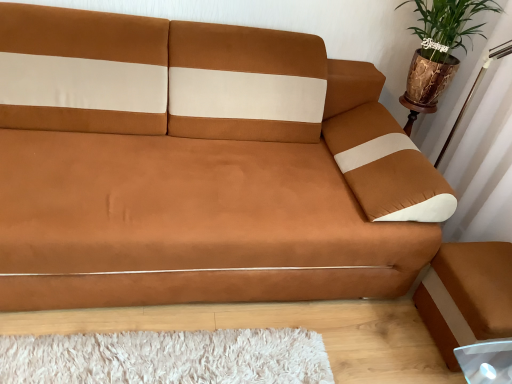
Question: Considering the relative positions of brown leather footrest at lower right and suede brown couch at center in the image provided, is brown leather footrest at lower right behind suede brown couch at center?

Choices:
 (A) yes
 (B) no

Answer: (A)

Question: From a real-world perspective, is brown leather footrest at lower right physically above suede brown couch at center?

Choices:
 (A) yes
 (B) no

Answer: (B)

Question: Considering the relative sizes of brown leather footrest at lower right and suede brown couch at center in the image provided, is brown leather footrest at lower right taller than suede brown couch at center?

Choices:
 (A) yes
 (B) no

Answer: (B)

Question: From the image's perspective, is brown leather footrest at lower right located above suede brown couch at center?

Choices:
 (A) no
 (B) yes

Answer: (A)

Question: Is brown leather footrest at lower right wider than suede brown couch at center?

Choices:
 (A) no
 (B) yes

Answer: (A)

Question: Is brown leather footrest at lower right far away from suede brown couch at center?

Choices:
 (A) no
 (B) yes

Answer: (A)

Question: Considering the relative positions of suede brown couch at center and green leafy plant in brown pot at upper right in the image provided, is suede brown couch at center to the left of green leafy plant in brown pot at upper right from the viewer's perspective?

Choices:
 (A) yes
 (B) no

Answer: (A)

Question: Considering the relative sizes of suede brown couch at center and green leafy plant in brown pot at upper right in the image provided, is suede brown couch at center thinner than green leafy plant in brown pot at upper right?

Choices:
 (A) yes
 (B) no

Answer: (B)

Question: From a real-world perspective, is suede brown couch at center located higher than green leafy plant in brown pot at upper right?

Choices:
 (A) no
 (B) yes

Answer: (A)

Question: Is suede brown couch at center not near green leafy plant in brown pot at upper right?

Choices:
 (A) no
 (B) yes

Answer: (A)

Question: From the image's perspective, is suede brown couch at center on green leafy plant in brown pot at upper right?

Choices:
 (A) yes
 (B) no

Answer: (B)

Question: Can you confirm if suede brown couch at center is taller than green leafy plant in brown pot at upper right?

Choices:
 (A) yes
 (B) no

Answer: (A)

Question: Are brown leather footrest at lower right and green leafy plant in brown pot at upper right located far from each other?

Choices:
 (A) yes
 (B) no

Answer: (B)